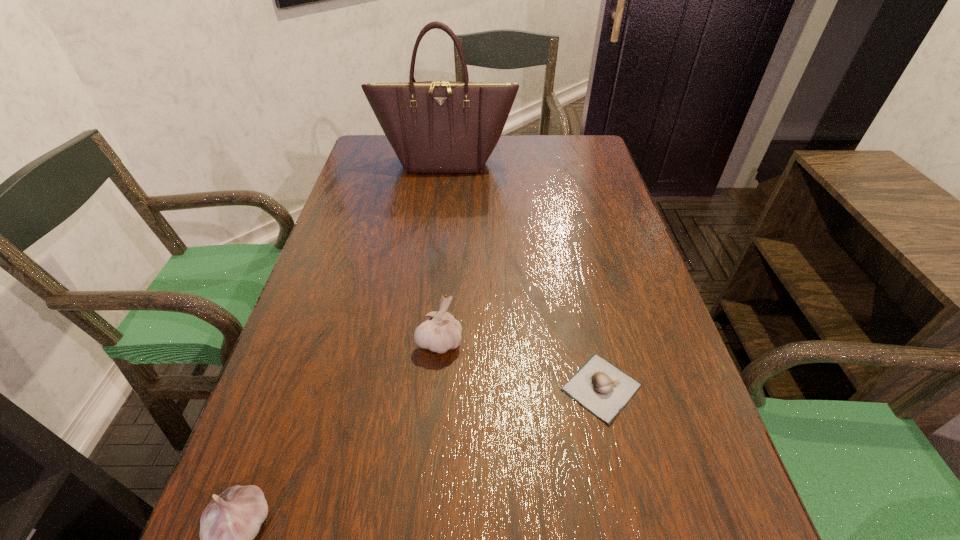
Identify the location of the tallest object. (433, 126).

Locate an element on the screen. This screenshot has height=540, width=960. handbag is located at coordinates pyautogui.click(x=433, y=126).

This screenshot has width=960, height=540. What are the coordinates of `the second garlic from left to right` in the screenshot? It's located at (440, 332).

Where is `the rightmost garlic`? The width and height of the screenshot is (960, 540). the rightmost garlic is located at coordinates (602, 388).

You are a GUI agent. You are given a task and a screenshot of the screen. Output one action in this format:
    pyautogui.click(x=<x>, y=<y>)
    Task: Click on the shortest object
    The height and width of the screenshot is (540, 960).
    Given the screenshot: What is the action you would take?
    pyautogui.click(x=602, y=388)

The height and width of the screenshot is (540, 960). In order to click on free space located on the front-facing side of the handbag in this screenshot , I will do `click(442, 189)`.

Locate an element on the screen. Image resolution: width=960 pixels, height=540 pixels. vacant area located on the front of the second garlic from left to right is located at coordinates (431, 442).

You are a GUI agent. You are given a task and a screenshot of the screen. Output one action in this format:
    pyautogui.click(x=<x>, y=<y>)
    Task: Click on the free space located on the back of the rightmost garlic
    The image size is (960, 540).
    Given the screenshot: What is the action you would take?
    pyautogui.click(x=584, y=310)

Where is `object located at the far edge`? object located at the far edge is located at coordinates (433, 126).

Locate an element on the screen. This screenshot has height=540, width=960. object that is at the left edge is located at coordinates (433, 126).